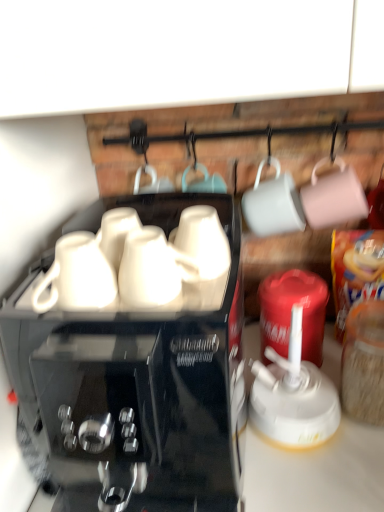
Question: Would you say white glossy mug at center, the first mug in the right-to-left sequence, is part of white glossy mug at center, which is counted as the second mug, starting from the right,'s contents?

Choices:
 (A) no
 (B) yes

Answer: (A)

Question: From a real-world perspective, is white glossy mug at center, which appears as the first mug when viewed from the left, located higher than white glossy mug at center, acting as the 2th mug starting from the left?

Choices:
 (A) no
 (B) yes

Answer: (A)

Question: Is white glossy mug at center, which appears as the first mug when viewed from the left, positioned behind white glossy mug at center, acting as the 2th mug starting from the left?

Choices:
 (A) yes
 (B) no

Answer: (B)

Question: Considering the relative sizes of white glossy mug at center, which appears as the first mug when viewed from the left, and white glossy mug at center, acting as the 2th mug starting from the left, in the image provided, is white glossy mug at center, which appears as the first mug when viewed from the left, wider than white glossy mug at center, acting as the 2th mug starting from the left,?

Choices:
 (A) no
 (B) yes

Answer: (B)

Question: From the image's perspective, is white glossy mug at center, which is counted as the second mug, starting from the right, below white glossy mug at center, acting as the 2th mug starting from the left?

Choices:
 (A) yes
 (B) no

Answer: (A)

Question: From the image's perspective, is white glossy mug at center, the first mug in the right-to-left sequence, above or below white glossy mug at center, which appears as the first mug when viewed from the left?

Choices:
 (A) below
 (B) above

Answer: (B)

Question: From a real-world perspective, is white glossy mug at center, the first mug in the right-to-left sequence, positioned above or below white glossy mug at center, which is counted as the second mug, starting from the right?

Choices:
 (A) above
 (B) below

Answer: (A)

Question: Looking at the image, does white glossy mug at center, acting as the 2th mug starting from the left, seem bigger or smaller compared to white glossy mug at center, which is counted as the second mug, starting from the right?

Choices:
 (A) small
 (B) big

Answer: (A)

Question: Considering the positions of white glossy mug at center, acting as the 2th mug starting from the left, and white glossy mug at center, which is counted as the second mug, starting from the right, in the image, is white glossy mug at center, acting as the 2th mug starting from the left, taller or shorter than white glossy mug at center, which is counted as the second mug, starting from the right,?

Choices:
 (A) short
 (B) tall

Answer: (B)

Question: Which is correct: white glossy mug at center, which is counted as the second mug, starting from the right, is inside white glossy mug at center, the first mug in the right-to-left sequence, or outside of it?

Choices:
 (A) outside
 (B) inside

Answer: (A)

Question: From the image's perspective, relative to white glossy mug at center, the first mug in the right-to-left sequence, is white glossy mug at center, which appears as the first mug when viewed from the left, above or below?

Choices:
 (A) below
 (B) above

Answer: (A)

Question: From a real-world perspective, is white glossy mug at center, which appears as the first mug when viewed from the left, physically located above or below white glossy mug at center, acting as the 2th mug starting from the left?

Choices:
 (A) below
 (B) above

Answer: (A)

Question: Does point 165,297 appear closer or farther from the camera than point 213,217?

Choices:
 (A) farther
 (B) closer

Answer: (B)

Question: In the image, is black glossy coffee maker at center positioned in front of or behind white glossy mug at center, the first mug in the right-to-left sequence?

Choices:
 (A) behind
 (B) front

Answer: (B)

Question: From the image's perspective, is black glossy coffee maker at center located above or below white glossy mug at center, the first mug in the right-to-left sequence?

Choices:
 (A) above
 (B) below

Answer: (B)